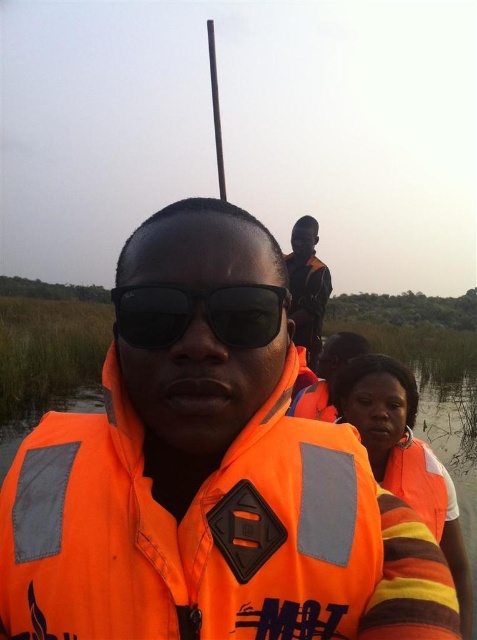
Is black matte sunglasses at center shorter than orange fabric construction worker at center?

Indeed, black matte sunglasses at center has a lesser height compared to orange fabric construction worker at center.

Describe the element at coordinates (195, 314) in the screenshot. Image resolution: width=477 pixels, height=640 pixels. I see `black matte sunglasses at center` at that location.

Image resolution: width=477 pixels, height=640 pixels. Find the location of `black matte sunglasses at center`. black matte sunglasses at center is located at coordinates (195, 314).

Which is behind, point (134, 442) or point (318, 330)?

Point (318, 330)

Which is below, orange fabric life jacket at center or orange fabric construction worker at center?

orange fabric life jacket at center is below.

Locate an element on the screen. Image resolution: width=477 pixels, height=640 pixels. orange fabric life jacket at center is located at coordinates (187, 531).

Does orange fabric life jacket at center appear on the left side of orange fabric life jacket at lower right?

Correct, you'll find orange fabric life jacket at center to the left of orange fabric life jacket at lower right.

Which is above, orange fabric life jacket at center or orange fabric life jacket at lower right?

Positioned higher is orange fabric life jacket at center.

Is point (188, 621) more distant than point (425, 451)?

No, (188, 621) is in front of (425, 451).

Locate an element on the screen. This screenshot has height=640, width=477. orange fabric life jacket at center is located at coordinates (187, 531).